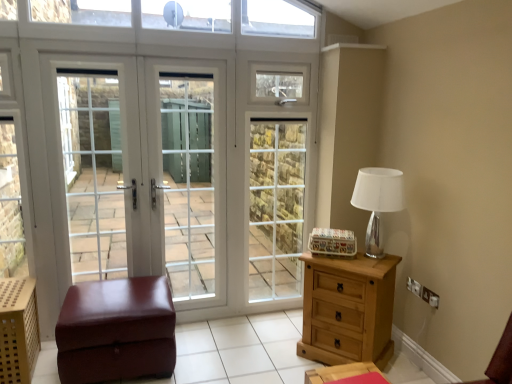
Question: Considering the relative sizes of white glass screen door at left, the third screen door from the right, and brown leather ottoman at lower left in the image provided, is white glass screen door at left, the third screen door from the right, thinner than brown leather ottoman at lower left?

Choices:
 (A) no
 (B) yes

Answer: (B)

Question: Is white glass screen door at left, the third screen door from the right, positioned behind brown leather ottoman at lower left?

Choices:
 (A) yes
 (B) no

Answer: (A)

Question: Is white glass screen door at left, arranged as the first screen door when viewed from the left, smaller than brown leather ottoman at lower left?

Choices:
 (A) yes
 (B) no

Answer: (A)

Question: Could you tell me if white glass screen door at left, arranged as the first screen door when viewed from the left, is turned towards brown leather ottoman at lower left?

Choices:
 (A) no
 (B) yes

Answer: (B)

Question: Would you say white glass screen door at left, arranged as the first screen door when viewed from the left, is outside brown leather ottoman at lower left?

Choices:
 (A) yes
 (B) no

Answer: (A)

Question: Does point (22, 306) appear closer or farther from the camera than point (326, 377)?

Choices:
 (A) farther
 (B) closer

Answer: (A)

Question: Choose the correct answer: Is wooden perforated crate at lower left inside wooden nightstand at lower right or outside it?

Choices:
 (A) inside
 (B) outside

Answer: (B)

Question: Considering the positions of wooden perforated crate at lower left and wooden nightstand at lower right in the image, is wooden perforated crate at lower left taller or shorter than wooden nightstand at lower right?

Choices:
 (A) short
 (B) tall

Answer: (B)

Question: From the image's perspective, is wooden perforated crate at lower left above or below wooden nightstand at lower right?

Choices:
 (A) below
 (B) above

Answer: (B)

Question: Considering their positions, is light brown wooden chest of drawers at right located in front of or behind silver metallic table lamp at right?

Choices:
 (A) behind
 (B) front

Answer: (B)

Question: From a real-world perspective, is light brown wooden chest of drawers at right above or below silver metallic table lamp at right?

Choices:
 (A) above
 (B) below

Answer: (B)

Question: Looking at their shapes, would you say light brown wooden chest of drawers at right is wider or thinner than silver metallic table lamp at right?

Choices:
 (A) thin
 (B) wide

Answer: (B)

Question: Is light brown wooden chest of drawers at right taller or shorter than silver metallic table lamp at right?

Choices:
 (A) tall
 (B) short

Answer: (A)

Question: Would you say white glass screen door at left, the third screen door from the right, is to the left or to the right of white glass screen door at center, acting as the 2th screen door starting from the right, in the picture?

Choices:
 (A) right
 (B) left

Answer: (B)

Question: Considering the positions of white glass screen door at left, the third screen door from the right, and white glass screen door at center, placed as the second screen door when sorted from left to right, in the image, is white glass screen door at left, the third screen door from the right, bigger or smaller than white glass screen door at center, placed as the second screen door when sorted from left to right,?

Choices:
 (A) big
 (B) small

Answer: (B)